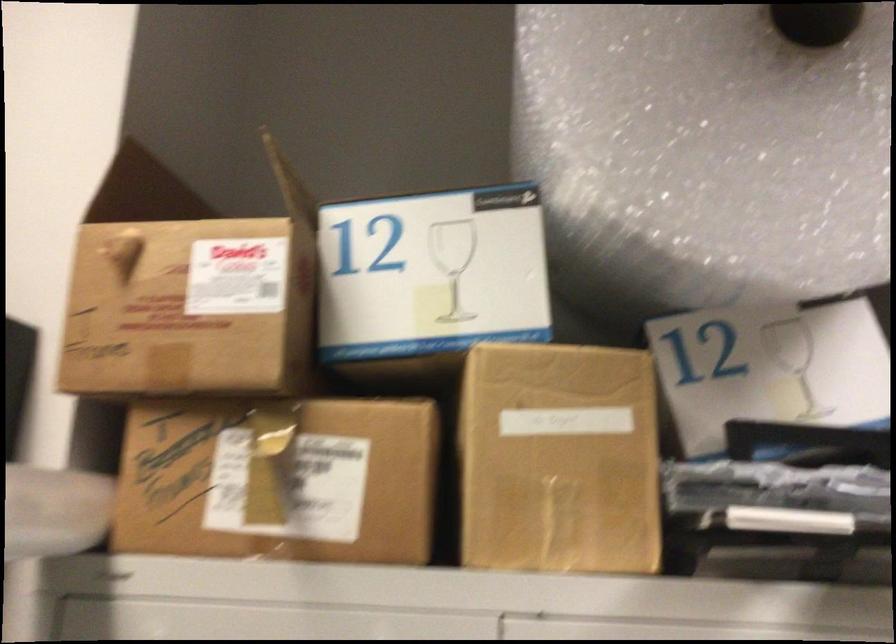
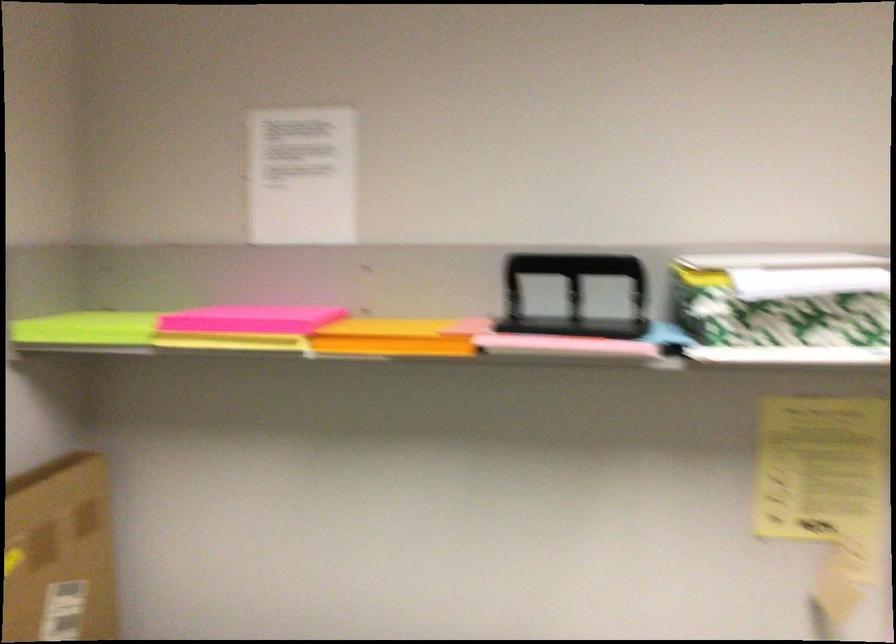
Question: Which direction would the cameraman need to move to produce the second image? Reply with the corresponding letter.

Choices:
 (A) Left
 (B) Right
 (C) Forward
 (D) Backward

Answer: (D)